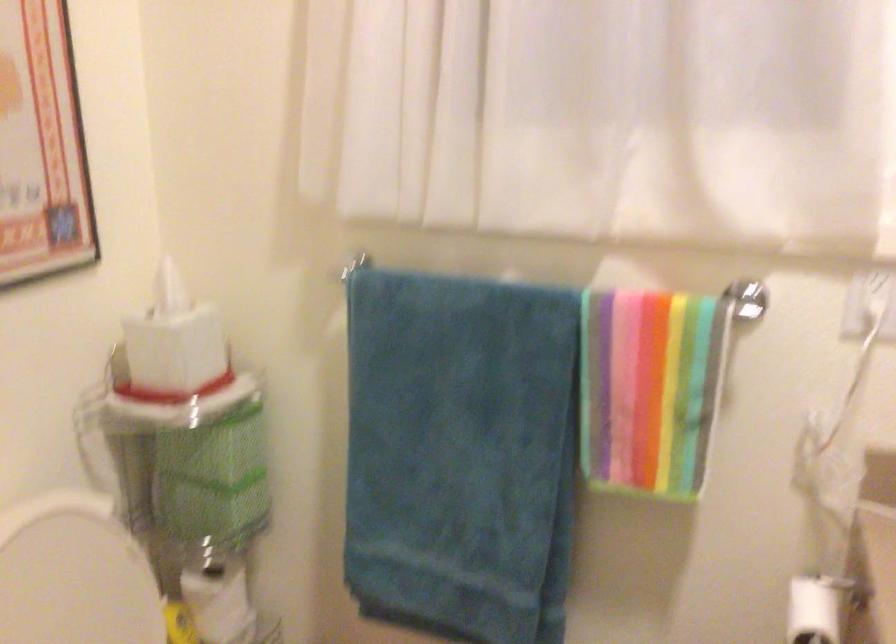
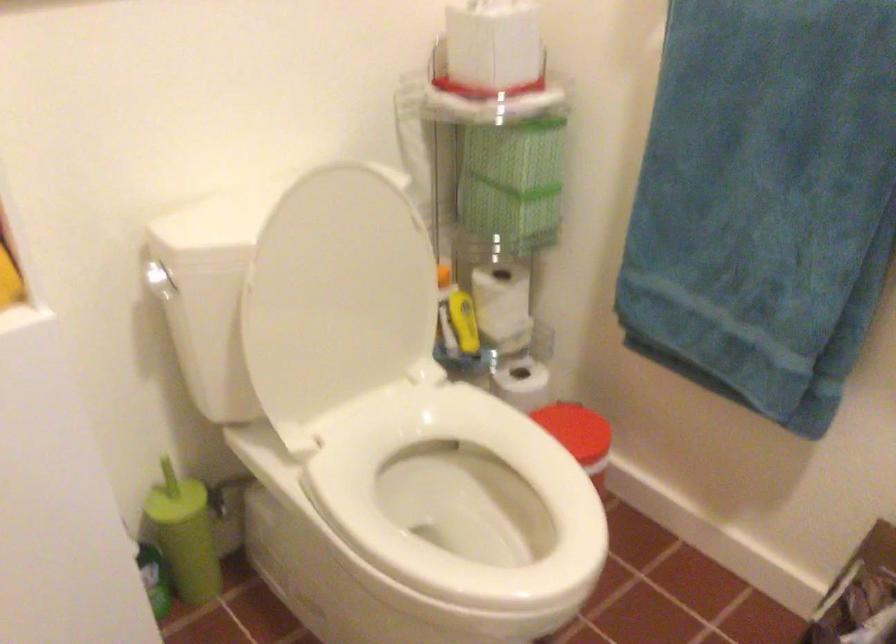
The first image is from the beginning of the video and the second image is from the end. How did the camera likely rotate when shooting the video?

The camera's rotation is toward left-down.